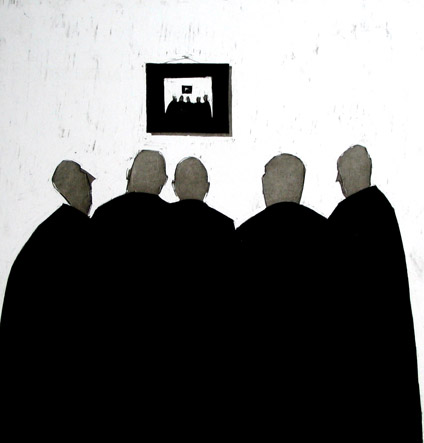
Where is `photo on wall`? The image size is (424, 443). photo on wall is located at coordinates (185, 87).